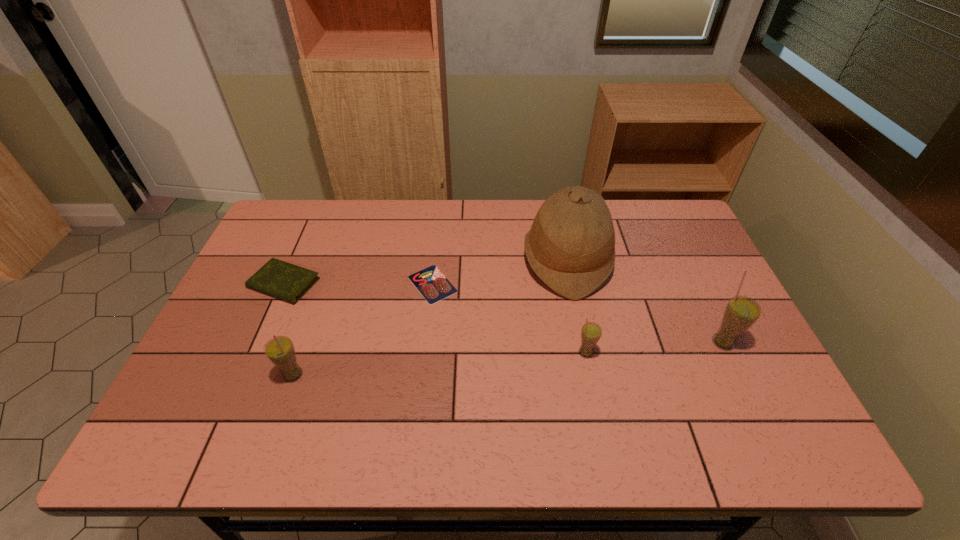
If equal spacing is desired by inserting an extra straw_(for_drinking) among them, please point out a free spot for this new straw_(for_drinking). Please provide its 2D coordinates. Your answer should be formatted as a tuple, i.e. [(x, y)], where the tuple contains the x and y coordinates of a point satisfying the conditions above.

[(443, 363)]